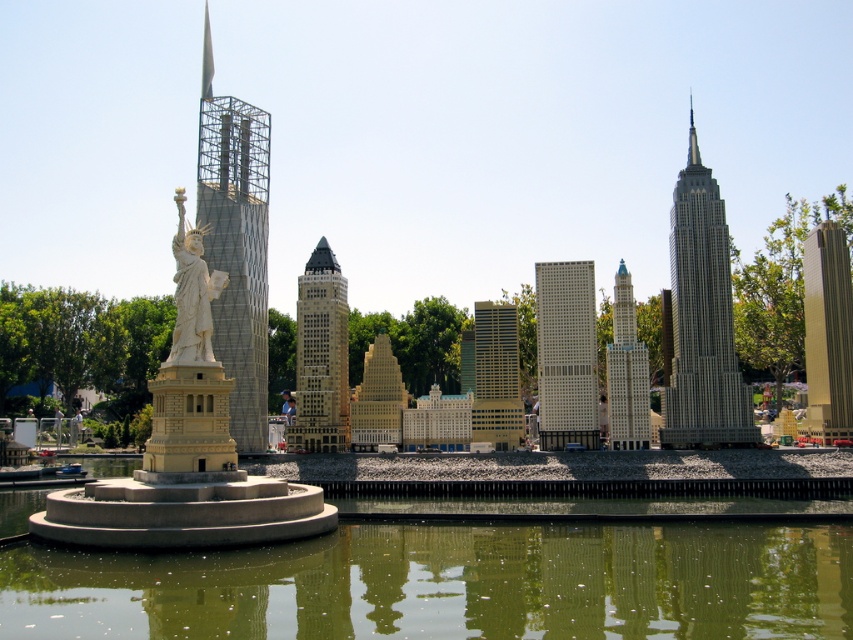
From the picture: You are a visitor at a miniature city model. You notice the light blue plastic skyscraper at center and the white stone statue at center. Which one is positioned lower in the scene?

The light blue plastic skyscraper at center is located below the white stone statue at center, so it is positioned lower in the scene.

Looking at this image, you are a city planner evaluating the miniature model. Which object in the scene is taller, the light blue plastic skyscraper at center or the white stone statue at center?

The light blue plastic skyscraper at center is taller than the white stone statue at center.